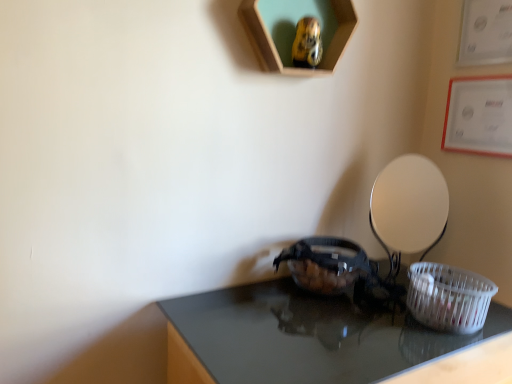
Locate an element on the screen. This screenshot has height=384, width=512. shiny black table at center is located at coordinates (302, 337).

Describe the element at coordinates (302, 337) in the screenshot. The height and width of the screenshot is (384, 512). I see `shiny black table at center` at that location.

The height and width of the screenshot is (384, 512). Describe the element at coordinates (448, 297) in the screenshot. I see `white plastic basket at lower right` at that location.

What is the approximate width of white plastic basket at lower right?

8.04 inches.

Locate an element on the screen. Image resolution: width=512 pixels, height=384 pixels. white plastic basket at lower right is located at coordinates (448, 297).

Where is `shiny black table at center`? shiny black table at center is located at coordinates (302, 337).

In the scene shown: Based on their positions, is white plastic basket at lower right located to the left or right of shiny black table at center?

Clearly, white plastic basket at lower right is on the right of shiny black table at center in the image.

Does white plastic basket at lower right come behind shiny black table at center?

That is True.

Is point (414, 293) farther from viewer compared to point (245, 286)?

No, (414, 293) is in front of (245, 286).

From the image's perspective, which one is positioned higher, white plastic basket at lower right or shiny black table at center?

From the image's view, white plastic basket at lower right is above.

From a real-world perspective, is white plastic basket at lower right positioned under shiny black table at center based on gravity?

No.

In the scene shown: Considering the sizes of objects white plastic basket at lower right and shiny black table at center in the image provided, who is thinner, white plastic basket at lower right or shiny black table at center?

white plastic basket at lower right is thinner.

Can you confirm if white plastic basket at lower right is taller than shiny black table at center?

No, white plastic basket at lower right is not taller than shiny black table at center.

Does white plastic basket at lower right have a smaller size compared to shiny black table at center?

Correct, white plastic basket at lower right occupies less space than shiny black table at center.

Is shiny black table at center a part of white plastic basket at lower right?

Actually, shiny black table at center is outside white plastic basket at lower right.

Is there a large distance between white plastic basket at lower right and shiny black table at center?

That's not correct — white plastic basket at lower right is a little close to shiny black table at center.

Consider the image. Is white plastic basket at lower right turned away from shiny black table at center?

No, white plastic basket at lower right is not facing away from shiny black table at center.

How many degrees apart are the facing directions of white plastic basket at lower right and shiny black table at center?

2.27 degrees.

At what (x,y) coordinates should I click in order to perform the action: click on basket that is on the right side of shiny black table at center. Please return your answer as a coordinate pair (x, y). The width and height of the screenshot is (512, 384). Looking at the image, I should click on (448, 297).

Is shiny black table at center to the right of white plastic basket at lower right from the viewer's perspective?

No.

Considering the positions of objects shiny black table at center and white plastic basket at lower right in the image provided, who is in front, shiny black table at center or white plastic basket at lower right?

shiny black table at center is closer to the camera.

Which is less distant, (365, 325) or (469, 289)?

Point (365, 325) appears to be farther away from the viewer than point (469, 289).

From the image's perspective, is shiny black table at center located above or below white plastic basket at lower right?

Based on their image positions, shiny black table at center is located beneath white plastic basket at lower right.

From a real-world perspective, between shiny black table at center and white plastic basket at lower right, who is vertically higher?

white plastic basket at lower right is physically above.

Considering the sizes of shiny black table at center and white plastic basket at lower right in the image, is shiny black table at center wider or thinner than white plastic basket at lower right?

In the image, shiny black table at center appears to be wider than white plastic basket at lower right.

Does shiny black table at center have a lesser height compared to white plastic basket at lower right?

No.

Does shiny black table at center have a larger size compared to white plastic basket at lower right?

Correct, shiny black table at center is larger in size than white plastic basket at lower right.

Can we say shiny black table at center lies outside white plastic basket at lower right?

shiny black table at center lies outside white plastic basket at lower right's area.

Is shiny black table at center next to white plastic basket at lower right and touching it?

No, shiny black table at center is not in contact with white plastic basket at lower right.

Is shiny black table at center looking in the opposite direction of white plastic basket at lower right?

No, shiny black table at center's orientation is not away from white plastic basket at lower right.

How many degrees apart are the facing directions of shiny black table at center and white plastic basket at lower right?

The facing directions of shiny black table at center and white plastic basket at lower right are 2.27 degrees apart.

Image resolution: width=512 pixels, height=384 pixels. Find the location of `table lying below the white plastic basket at lower right (from the image's perspective)`. table lying below the white plastic basket at lower right (from the image's perspective) is located at coordinates (302, 337).

I want to click on basket on the right of shiny black table at center, so click(448, 297).

Identify the location of table lying in front of the white plastic basket at lower right. (302, 337).